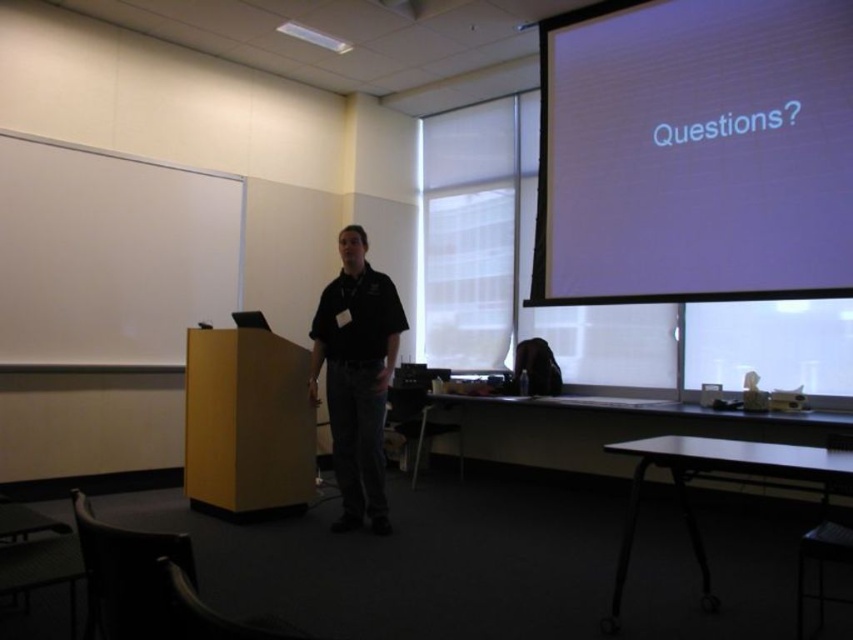
You are a student sitting in the classroom and want to see both the yellow wood podium at left and the white matte projection screen at upper right clearly. Which object is higher in the image?

The white matte projection screen at upper right is located above the yellow wood podium at left, so it is higher in the image.

You are a student sitting in the classroom and need to determine which object is wider between the white matte projection screen at upper right and the yellow wood podium at left. Based on the scene, which one is wider?

The white matte projection screen at upper right is wider than the yellow wood podium at left according to the description.

You are a student sitting in the classroom and want to ask a question. You need to walk to the front and approach the yellow wood podium at left and the black matte shirt at center. Which object should you head towards first?

The yellow wood podium at left is positioned on the left side of black matte shirt at center, so you should head towards the yellow wood podium at left first since it is closer to your current position on the left side.